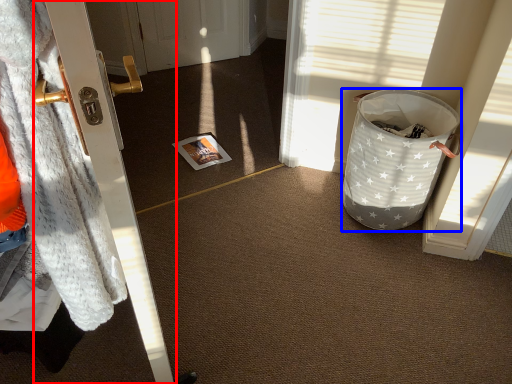
Question: Among these objects, which one is farthest to the camera, door (highlighted by a red box) or trash bin/can (highlighted by a blue box)?

Choices:
 (A) door
 (B) trash bin/can

Answer: (B)